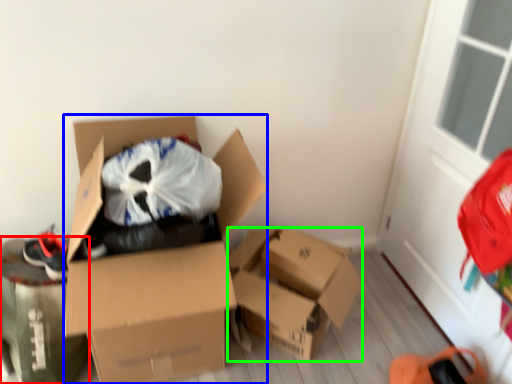
Question: Considering the real-world distances, which object is closest to cardboard box (highlighted by a red box)? box (highlighted by a blue box) or box (highlighted by a green box).

Choices:
 (A) box
 (B) box

Answer: (A)